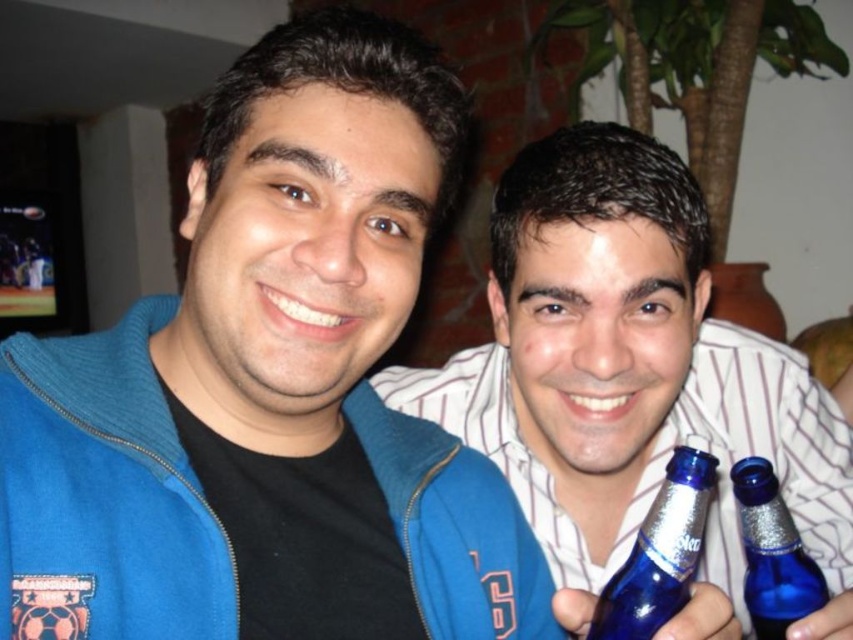
Question: Which of the following is the farthest from the observer?

Choices:
 (A) blue glass bottle at center
 (B) blue glass bottle at lower right
 (C) blue zip-up jacket at center
 (D) blue glass bottle at right

Answer: (A)

Question: Observing the image, what is the correct spatial positioning of blue zip-up jacket at center in reference to blue glass bottle at center?

Choices:
 (A) below
 (B) above

Answer: (B)

Question: Considering the relative positions of blue zip-up jacket at center and blue glass bottle at center in the image provided, where is blue zip-up jacket at center located with respect to blue glass bottle at center?

Choices:
 (A) right
 (B) left

Answer: (B)

Question: Estimate the real-world distances between objects in this image. Which object is farther from the blue glass bottle at right?

Choices:
 (A) blue glass bottle at center
 (B) blue zip-up jacket at center

Answer: (A)

Question: Estimate the real-world distances between objects in this image. Which object is closer to the blue glass bottle at center?

Choices:
 (A) blue glass bottle at lower right
 (B) blue zip-up jacket at center

Answer: (B)

Question: Is blue zip-up jacket at center behind blue glass bottle at lower right?

Choices:
 (A) yes
 (B) no

Answer: (A)